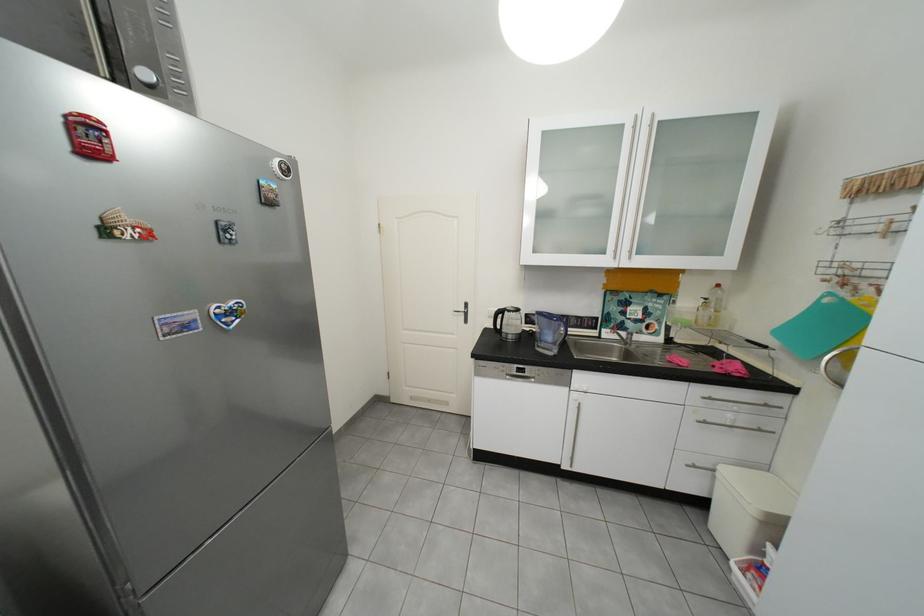
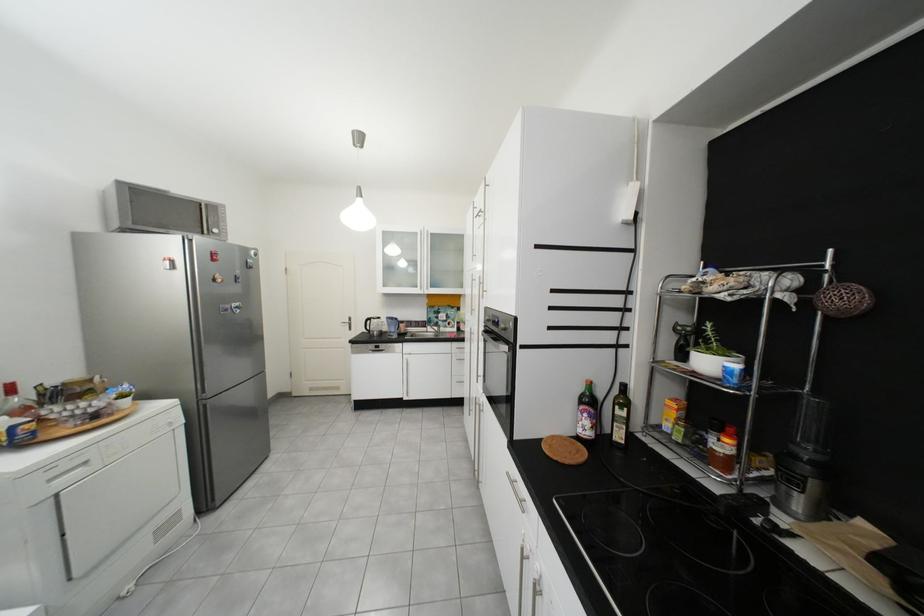
In the second image, find the point that corresponds to (x=585, y=323) in the first image.

(426, 325)